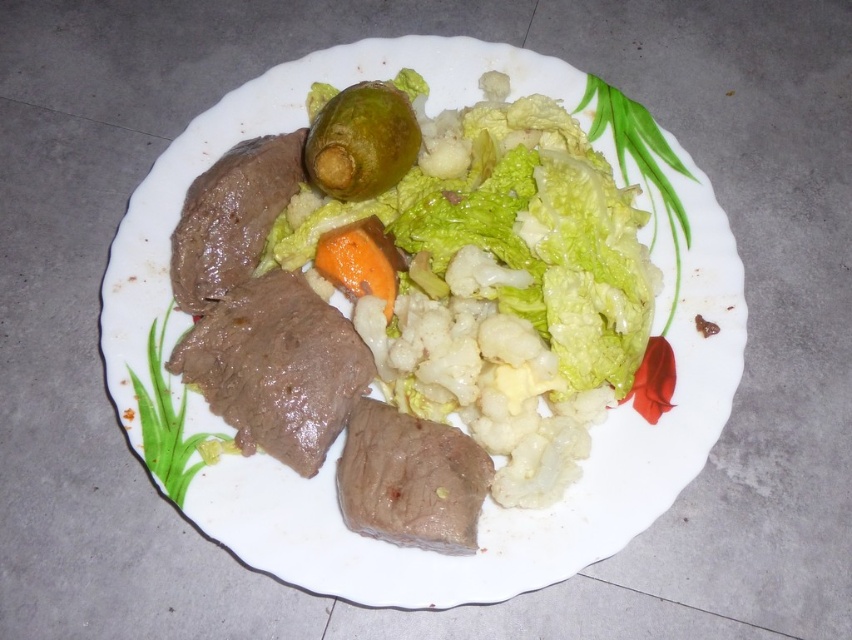
Question: Estimate the real-world distances between objects in this image. Which object is closer to the smooth brown meat at center?

Choices:
 (A) pinkish-brown raw meat at center
 (B) green glossy pickle at center

Answer: (A)

Question: Is pinkish-brown raw meat at center to the left of brown matte meat at upper left from the viewer's perspective?

Choices:
 (A) no
 (B) yes

Answer: (A)

Question: Is pinkish-brown raw meat at center closer to the viewer compared to orange smooth carrot at center?

Choices:
 (A) no
 (B) yes

Answer: (B)

Question: Which object is closer to the camera taking this photo?

Choices:
 (A) green glossy pickle at center
 (B) smooth brown meat at center
 (C) pinkish-brown raw meat at center

Answer: (C)

Question: In this image, where is pinkish-brown raw meat at center located relative to green glossy pickle at center?

Choices:
 (A) below
 (B) above

Answer: (A)

Question: Estimate the real-world distances between objects in this image. Which object is farther from the orange smooth carrot at center?

Choices:
 (A) brown glossy meat at center
 (B) green glossy pickle at center
 (C) brown matte meat at upper left

Answer: (C)